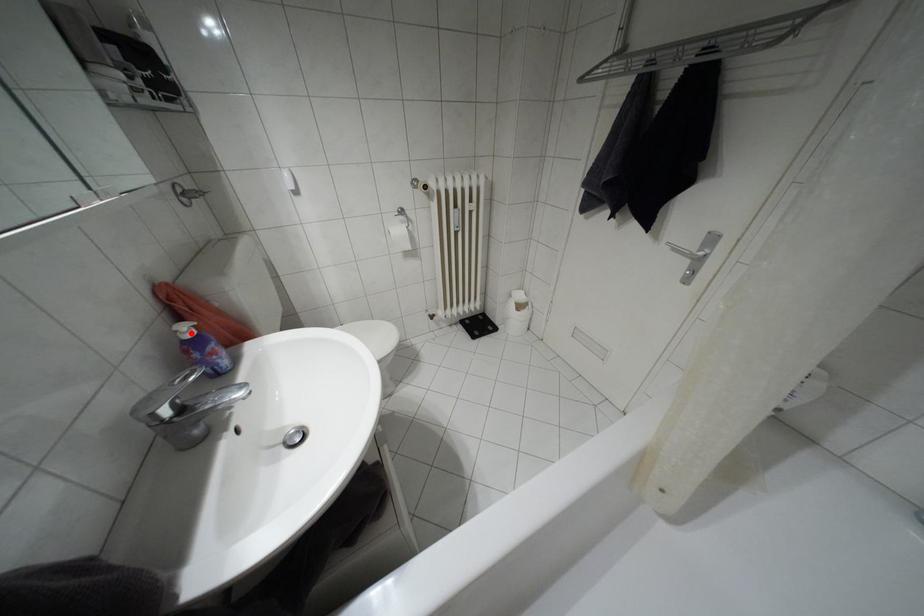
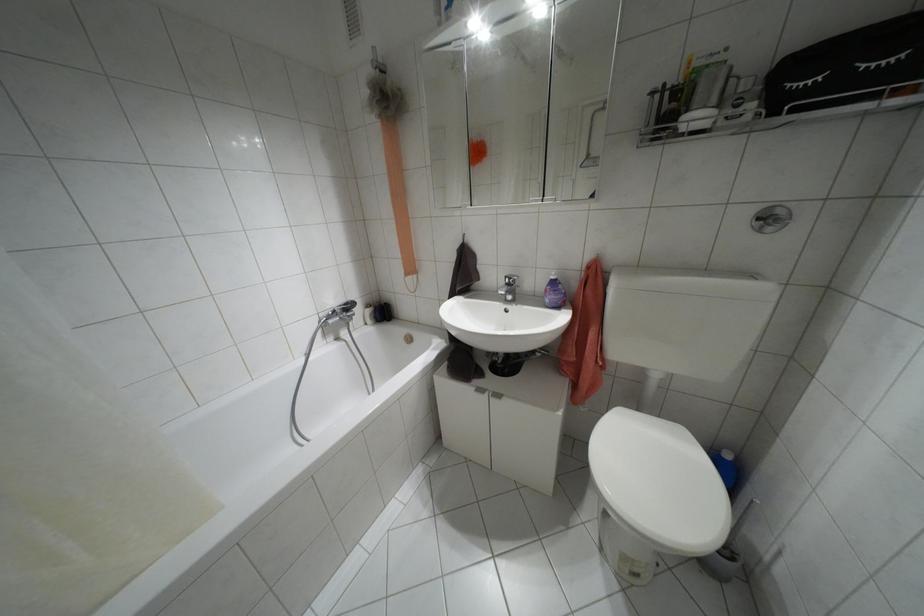
Where in the second image is the point corresponding to the highlighted location from the first image?

(552, 277)